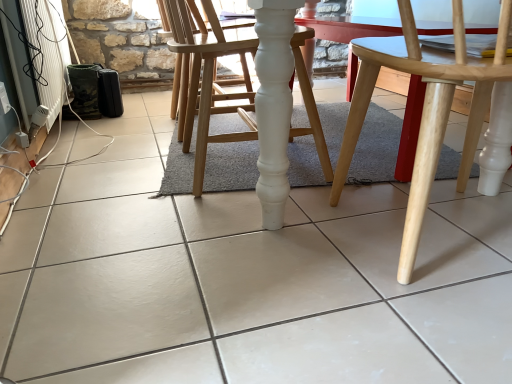
Question: Is white wood chair at center, which ranks as the 1th chair in left-to-right order, oriented away from white plastic radiator at lower left?

Choices:
 (A) yes
 (B) no

Answer: (B)

Question: From the image's perspective, is white wood chair at center, which ranks as the 1th chair in left-to-right order, on top of white plastic radiator at lower left?

Choices:
 (A) yes
 (B) no

Answer: (B)

Question: Considering the relative sizes of white wood chair at center, the second chair positioned from the right, and white plastic radiator at lower left in the image provided, is white wood chair at center, the second chair positioned from the right, thinner than white plastic radiator at lower left?

Choices:
 (A) no
 (B) yes

Answer: (A)

Question: Is white wood chair at center, which ranks as the 1th chair in left-to-right order, completely or partially outside of white plastic radiator at lower left?

Choices:
 (A) yes
 (B) no

Answer: (A)

Question: Is white wood chair at center, which ranks as the 1th chair in left-to-right order, aimed at white plastic radiator at lower left?

Choices:
 (A) no
 (B) yes

Answer: (A)

Question: Is point (202, 109) closer or farther from the camera than point (462, 183)?

Choices:
 (A) farther
 (B) closer

Answer: (B)

Question: Choose the correct answer: Is white wood chair at center, which ranks as the 1th chair in left-to-right order, inside natural wood chair at center, which is the 1th chair from right to left, or outside it?

Choices:
 (A) outside
 (B) inside

Answer: (A)

Question: Considering the positions of white wood chair at center, which ranks as the 1th chair in left-to-right order, and natural wood chair at center, the second chair from the left, in the image, is white wood chair at center, which ranks as the 1th chair in left-to-right order, taller or shorter than natural wood chair at center, the second chair from the left,?

Choices:
 (A) short
 (B) tall

Answer: (B)

Question: Relative to natural wood chair at center, the second chair from the left, is white wood chair at center, the second chair positioned from the right, in front or behind?

Choices:
 (A) behind
 (B) front

Answer: (A)

Question: From the image's perspective, relative to white wood chair at center, the second chair positioned from the right, is white plastic radiator at lower left above or below?

Choices:
 (A) above
 (B) below

Answer: (A)

Question: From a real-world perspective, is white plastic radiator at lower left above or below white wood chair at center, which ranks as the 1th chair in left-to-right order?

Choices:
 (A) above
 (B) below

Answer: (A)

Question: Considering the positions of white plastic radiator at lower left and white wood chair at center, which ranks as the 1th chair in left-to-right order, in the image, is white plastic radiator at lower left wider or thinner than white wood chair at center, which ranks as the 1th chair in left-to-right order,?

Choices:
 (A) thin
 (B) wide

Answer: (A)

Question: Looking at the image, does white plastic radiator at lower left seem bigger or smaller compared to white wood chair at center, the second chair positioned from the right?

Choices:
 (A) small
 (B) big

Answer: (A)

Question: Looking at their shapes, would you say natural wood chair at center, which is the 1th chair from right to left, is wider or thinner than white plastic radiator at lower left?

Choices:
 (A) thin
 (B) wide

Answer: (B)

Question: Is natural wood chair at center, the second chair from the left, in front of or behind white plastic radiator at lower left in the image?

Choices:
 (A) front
 (B) behind

Answer: (A)